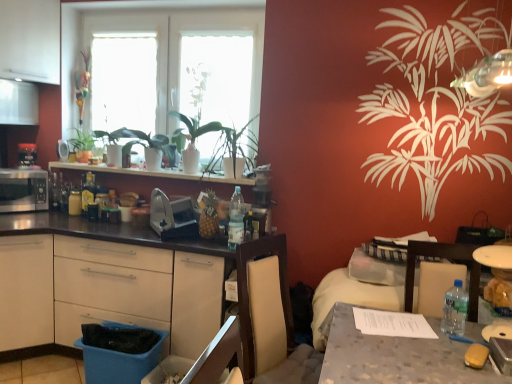
Question: Does white matte window screen at upper center, which ranks as the 1th window screen in right-to-left order, have a smaller size compared to clear plastic bottle at table right, which is the 1th bottle in front-to-back order?

Choices:
 (A) yes
 (B) no

Answer: (B)

Question: Is white matte window screen at upper center, the second window screen positioned from the left, far away from clear plastic bottle at table right, which is the 1th bottle in front-to-back order?

Choices:
 (A) no
 (B) yes

Answer: (B)

Question: Is white matte window screen at upper center, the second window screen positioned from the left, directly adjacent to clear plastic bottle at table right, which is the first bottle from right to left?

Choices:
 (A) no
 (B) yes

Answer: (A)

Question: Considering the relative sizes of white matte window screen at upper center, which ranks as the 1th window screen in right-to-left order, and clear plastic bottle at table right, which is the first bottle from right to left, in the image provided, is white matte window screen at upper center, which ranks as the 1th window screen in right-to-left order, bigger than clear plastic bottle at table right, which is the first bottle from right to left,?

Choices:
 (A) no
 (B) yes

Answer: (B)

Question: From the image's perspective, is white matte window screen at upper center, the second window screen positioned from the left, under clear plastic bottle at table right, the third bottle when ordered from back to front?

Choices:
 (A) no
 (B) yes

Answer: (A)

Question: Considering the positions of green leafy plant at left and white glass window at upper center in the image, is green leafy plant at left taller or shorter than white glass window at upper center?

Choices:
 (A) short
 (B) tall

Answer: (A)

Question: Which is correct: green leafy plant at left is inside white glass window at upper center, or outside of it?

Choices:
 (A) inside
 (B) outside

Answer: (B)

Question: Relative to white glass window at upper center, is green leafy plant at left in front or behind?

Choices:
 (A) front
 (B) behind

Answer: (B)

Question: Visually, is green leafy plant at left positioned to the left or to the right of white glass window at upper center?

Choices:
 (A) right
 (B) left

Answer: (B)

Question: In the image, is white matte window screen at upper center, the second window screen positioned from the left, on the left side or the right side of blue plastic drawer at lower left?

Choices:
 (A) right
 (B) left

Answer: (A)

Question: In the image, is white matte window screen at upper center, the second window screen positioned from the left, positioned in front of or behind blue plastic drawer at lower left?

Choices:
 (A) behind
 (B) front

Answer: (A)

Question: In terms of size, does white matte window screen at upper center, which ranks as the 1th window screen in right-to-left order, appear bigger or smaller than blue plastic drawer at lower left?

Choices:
 (A) big
 (B) small

Answer: (A)

Question: Is white matte window screen at upper center, which ranks as the 1th window screen in right-to-left order, situated inside blue plastic drawer at lower left or outside?

Choices:
 (A) outside
 (B) inside

Answer: (A)

Question: Is matte silver microwave at left, arranged as the 4th appliance when viewed from the right, in front of or behind blue plastic drawer at lower left in the image?

Choices:
 (A) behind
 (B) front

Answer: (A)

Question: From a real-world perspective, is matte silver microwave at left, the first appliance viewed from the left, positioned above or below blue plastic drawer at lower left?

Choices:
 (A) below
 (B) above

Answer: (B)